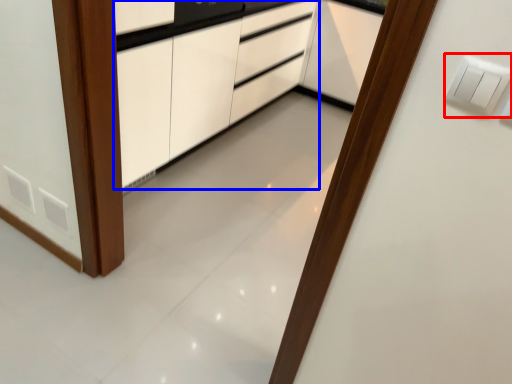
Question: Which of the following is the farthest to the observer, light switch (highlighted by a red box) or cabinetry (highlighted by a blue box)?

Choices:
 (A) light switch
 (B) cabinetry

Answer: (B)